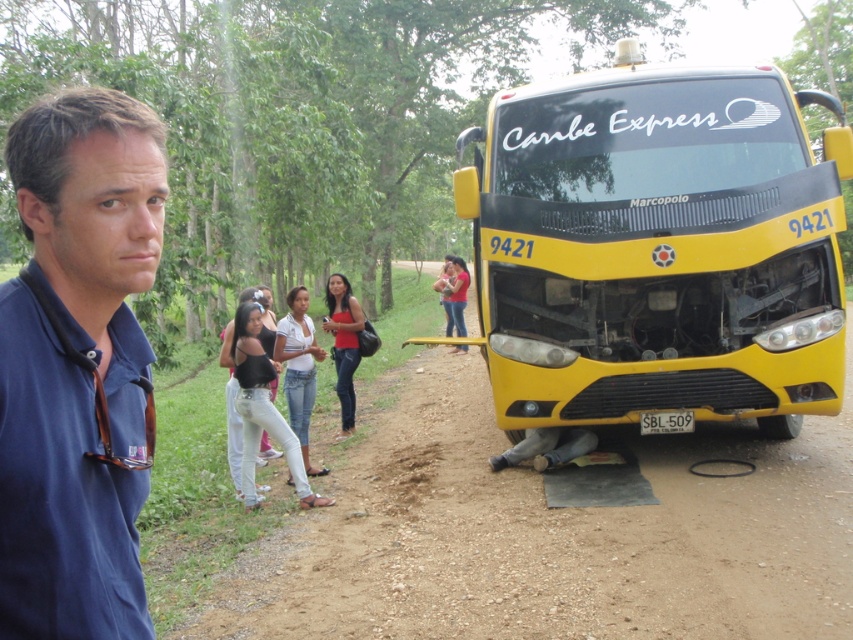
What do you see at coordinates (657, 248) in the screenshot?
I see `yellow matte bus at right` at bounding box center [657, 248].

Is point (662, 196) farther from camera compared to point (256, 577)?

Yes, it is.

Identify the location of yellow matte bus at right. (657, 248).

Is dirt track at center wider than blue fabric shirt at left?

Yes, dirt track at center is wider than blue fabric shirt at left.

Is dirt track at center smaller than blue fabric shirt at left?

Yes.

Does point (369, 513) lie behind point (4, 538)?

Yes, it is.

Locate an element on the screen. Image resolution: width=853 pixels, height=640 pixels. dirt track at center is located at coordinates (549, 534).

Who is more forward, [715,180] or [41,339]?

Point [41,339] is in front.

Describe the element at coordinates (657, 248) in the screenshot. I see `yellow matte bus at right` at that location.

The height and width of the screenshot is (640, 853). What are the coordinates of `yellow matte bus at right` in the screenshot? It's located at (657, 248).